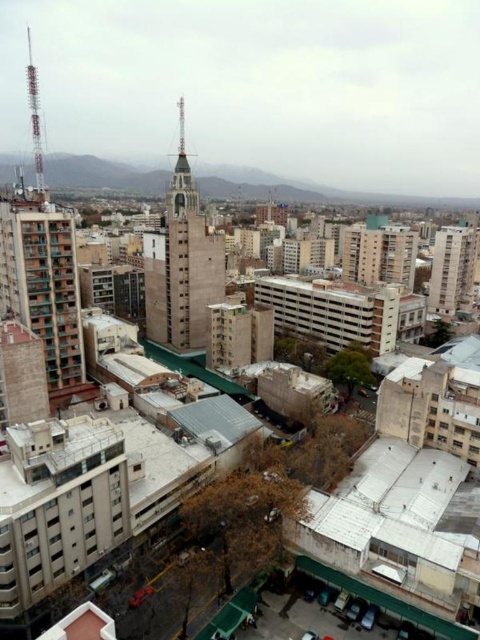
Question: Which of the following is the farthest from the observer?

Choices:
 (A) smooth concrete building at upper right
 (B) green concrete building at left
 (C) concrete tower at center

Answer: (A)

Question: Is concrete tower at center thinner than smooth concrete building at upper right?

Choices:
 (A) yes
 (B) no

Answer: (B)

Question: Estimate the real-world distances between objects in this image. Which object is closer to the smooth concrete building at upper right?

Choices:
 (A) green concrete building at left
 (B) concrete tower at center

Answer: (B)

Question: Does concrete tower at center appear under smooth concrete building at upper right?

Choices:
 (A) no
 (B) yes

Answer: (A)

Question: Can you confirm if concrete tower at center is positioned above smooth concrete building at upper right?

Choices:
 (A) yes
 (B) no

Answer: (A)

Question: Among these objects, which one is nearest to the camera?

Choices:
 (A) smooth concrete building at upper right
 (B) concrete tower at center
 (C) green concrete building at left

Answer: (C)